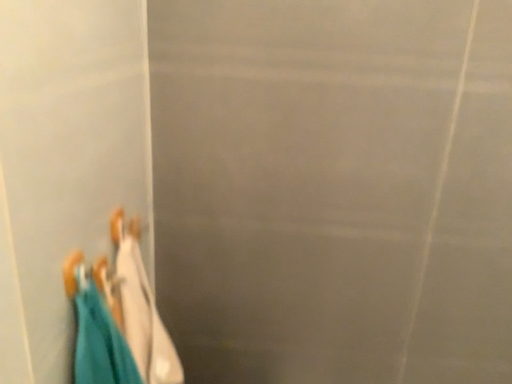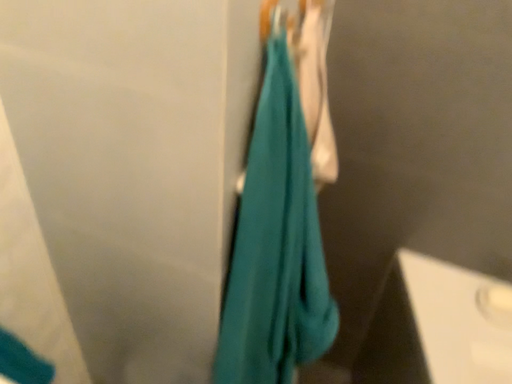
Question: How did the camera likely rotate when shooting the video?

Choices:
 (A) rotated right
 (B) rotated left

Answer: (B)